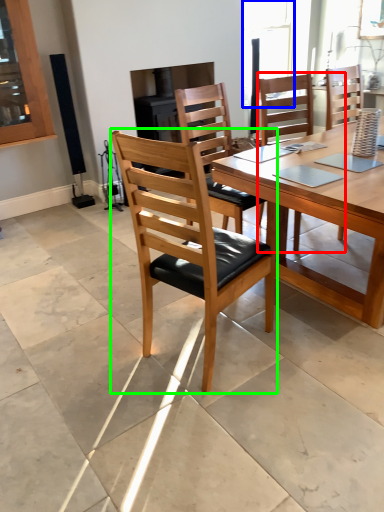
Question: Which is nearer to the chair (highlighted by a red box)? window (highlighted by a blue box) or chair (highlighted by a green box).

Choices:
 (A) window
 (B) chair

Answer: (B)